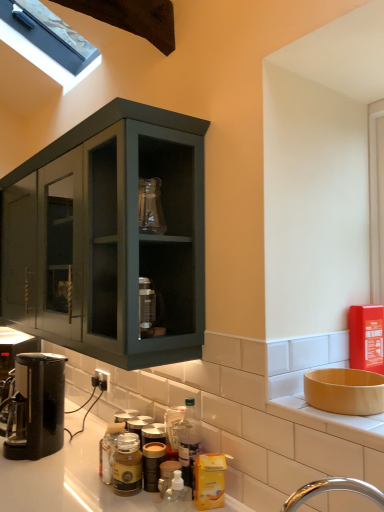
Describe the element at coordinates (189, 443) in the screenshot. I see `translucent plastic bottle at lower center, marked as the first bottle in a back-to-front arrangement` at that location.

Describe the element at coordinates (36, 407) in the screenshot. This screenshot has height=512, width=384. I see `black plastic coffee machine at lower left, the first coffee machine when ordered from front to back` at that location.

Describe the element at coordinates (209, 481) in the screenshot. This screenshot has width=384, height=512. I see `yellow plastic bottle at lower center, which is counted as the first bottle, starting from the right` at that location.

What do you see at coordinates (12, 355) in the screenshot?
I see `black plastic coffee machine at lower left, positioned as the first coffee machine in left-to-right order` at bounding box center [12, 355].

Locate an element on the screen. translucent plastic bottle at lower center, arranged as the first bottle when viewed from the front is located at coordinates (177, 495).

Based on the photo, in order to face translucent plastic bottle at lower center, the 4th bottle from the back, should I rotate leftwards or rightwards?

Rotate your view left by about 1.841°.

Consider the image. What is the approximate width of matte yellow bowl at right?

It is 8.83 inches.

This screenshot has height=512, width=384. Find the location of `translucent plastic bottle at lower center, which is the third bottle from left to right`. translucent plastic bottle at lower center, which is the third bottle from left to right is located at coordinates (189, 443).

At what (x,y) coordinates should I click in order to perform the action: click on the 1st bottle in front of the black plastic electric outlet at lower left, counting from the anchor's position. Please return your answer as a coordinate pair (x, y). The height and width of the screenshot is (512, 384). Looking at the image, I should click on (189, 443).

Would you say black plastic electric outlet at lower left is outside translucent plastic bottle at lower center, placed as the 4th bottle when sorted from front to back?

Yes, black plastic electric outlet at lower left is outside of translucent plastic bottle at lower center, placed as the 4th bottle when sorted from front to back.

Consider the image. Can you see black plastic electric outlet at lower left touching translucent plastic bottle at lower center, marked as the first bottle in a back-to-front arrangement?

No, black plastic electric outlet at lower left is not beside translucent plastic bottle at lower center, marked as the first bottle in a back-to-front arrangement.

Considering the positions of point (96, 375) and point (189, 453), is point (96, 375) closer or farther from the camera than point (189, 453)?

Point (96, 375) is farther from the camera than point (189, 453).

Is matte yellow bowl at right in front of or behind translucent plastic bottle at lower center, which is the second bottle from right to left, in the image?

Visually, matte yellow bowl at right is located in front of translucent plastic bottle at lower center, which is the second bottle from right to left.

Is matte yellow bowl at right smaller than translucent plastic bottle at lower center, marked as the first bottle in a back-to-front arrangement?

No.

Is matte yellow bowl at right taller than translucent plastic bottle at lower center, marked as the first bottle in a back-to-front arrangement?

In fact, matte yellow bowl at right may be shorter than translucent plastic bottle at lower center, marked as the first bottle in a back-to-front arrangement.

Would you consider matte yellow bowl at right to be distant from translucent plastic bottle at lower center, which is the third bottle from left to right?

No, there isn't a large distance between matte yellow bowl at right and translucent plastic bottle at lower center, which is the third bottle from left to right.

Is black plastic coffee machine at lower left, arranged as the 2th coffee machine when viewed from the back, located within matte yellow bowl at right?

No, black plastic coffee machine at lower left, arranged as the 2th coffee machine when viewed from the back, is not a part of matte yellow bowl at right.

Is matte yellow bowl at right thinner than black plastic coffee machine at lower left, the first coffee machine when ordered from front to back?

Indeed, matte yellow bowl at right has a lesser width compared to black plastic coffee machine at lower left, the first coffee machine when ordered from front to back.

Who is taller, matte yellow bowl at right or black plastic coffee machine at lower left, the first coffee machine when ordered from front to back?

With more height is black plastic coffee machine at lower left, the first coffee machine when ordered from front to back.

From a real-world perspective, which object rests below the other?

matte glass jar at center, marked as the first bottle in a left-to-right arrangement, from a real-world perspective.

From the image's perspective, is matte glass jar at center, positioned as the 4th bottle in right-to-left order, beneath black plastic electric outlet at lower left?

Correct, matte glass jar at center, positioned as the 4th bottle in right-to-left order, appears lower than black plastic electric outlet at lower left in the image.

Considering the sizes of objects matte glass jar at center, arranged as the 2th bottle when viewed from the back, and black plastic electric outlet at lower left in the image provided, who is thinner, matte glass jar at center, arranged as the 2th bottle when viewed from the back, or black plastic electric outlet at lower left?

black plastic electric outlet at lower left is thinner.

Considering the sizes of matte glass jar at center, positioned as the 4th bottle in right-to-left order, and black plastic electric outlet at lower left in the image, is matte glass jar at center, positioned as the 4th bottle in right-to-left order, taller or shorter than black plastic electric outlet at lower left?

Considering their sizes, matte glass jar at center, positioned as the 4th bottle in right-to-left order, has more height than black plastic electric outlet at lower left.

Is black plastic coffee machine at lower left, positioned as the first coffee machine in back-to-front order, turned away from black plastic electric outlet at lower left?

No.

How distant is black plastic coffee machine at lower left, positioned as the first coffee machine in left-to-right order, from black plastic electric outlet at lower left?

The distance of black plastic coffee machine at lower left, positioned as the first coffee machine in left-to-right order, from black plastic electric outlet at lower left is 17.47 inches.

How different are the orientations of black plastic coffee machine at lower left, the second coffee machine positioned from the front, and black plastic electric outlet at lower left in degrees?

black plastic coffee machine at lower left, the second coffee machine positioned from the front, and black plastic electric outlet at lower left are facing 49.5 degrees away from each other.

Consider the image. Does black plastic coffee machine at lower left, positioned as the first coffee machine in left-to-right order, have a smaller size compared to black plastic electric outlet at lower left?

Actually, black plastic coffee machine at lower left, positioned as the first coffee machine in left-to-right order, might be larger than black plastic electric outlet at lower left.

From a real-world perspective, is matte glass jar at center, positioned as the 4th bottle in right-to-left order, over black plastic coffee machine at lower left, positioned as the first coffee machine in back-to-front order?

Incorrect, from a real-world perspective, matte glass jar at center, positioned as the 4th bottle in right-to-left order, is lower than black plastic coffee machine at lower left, positioned as the first coffee machine in back-to-front order.

Is matte glass jar at center, which is the 3th bottle in front-to-back order, located outside black plastic coffee machine at lower left, positioned as the first coffee machine in back-to-front order?

matte glass jar at center, which is the 3th bottle in front-to-back order, is positioned outside black plastic coffee machine at lower left, positioned as the first coffee machine in back-to-front order.

Which object is closer to the camera taking this photo, matte glass jar at center, marked as the first bottle in a left-to-right arrangement, or black plastic coffee machine at lower left, the second coffee machine positioned from the front?

matte glass jar at center, marked as the first bottle in a left-to-right arrangement, is more forward.

Is matte glass jar at center, marked as the first bottle in a left-to-right arrangement, facing towards black plastic coffee machine at lower left, positioned as the first coffee machine in back-to-front order?

No, matte glass jar at center, marked as the first bottle in a left-to-right arrangement, is not oriented towards black plastic coffee machine at lower left, positioned as the first coffee machine in back-to-front order.

In the scene shown: Which object is further away from the camera taking this photo, matte glass jar at center, positioned as the 4th bottle in right-to-left order, or matte yellow bowl at right?

matte glass jar at center, positioned as the 4th bottle in right-to-left order, is behind.

Can you confirm if matte glass jar at center, marked as the first bottle in a left-to-right arrangement, is wider than matte yellow bowl at right?

In fact, matte glass jar at center, marked as the first bottle in a left-to-right arrangement, might be narrower than matte yellow bowl at right.

Considering the relative sizes of matte glass jar at center, which is the 3th bottle in front-to-back order, and matte yellow bowl at right in the image provided, is matte glass jar at center, which is the 3th bottle in front-to-back order, smaller than matte yellow bowl at right?

Correct, matte glass jar at center, which is the 3th bottle in front-to-back order, occupies less space than matte yellow bowl at right.

Is matte glass jar at center, which is the 3th bottle in front-to-back order, not within matte yellow bowl at right?

Absolutely, matte glass jar at center, which is the 3th bottle in front-to-back order, is external to matte yellow bowl at right.

At what (x,y) coordinates should I click in order to perform the action: click on bottle that is the 3rd object to the right of the black plastic electric outlet at lower left, starting at the anchor. Please return your answer as a coordinate pair (x, y). Image resolution: width=384 pixels, height=512 pixels. Looking at the image, I should click on (189, 443).

Image resolution: width=384 pixels, height=512 pixels. Find the location of `bottle that is the 4th object located behind the matte yellow bowl at right`. bottle that is the 4th object located behind the matte yellow bowl at right is located at coordinates [189, 443].

Estimate the real-world distances between objects in this image. Which object is further from translucent plastic bottle at lower center, placed as the 2th bottle when sorted from left to right, matte yellow bowl at right or yellow plastic bottle at lower center, the 2th bottle positioned from the front?

matte yellow bowl at right is positioned further to the anchor translucent plastic bottle at lower center, placed as the 2th bottle when sorted from left to right.

Considering their positions, is yellow plastic bottle at lower center, the 2th bottle positioned from the front, positioned further to translucent plastic bottle at lower center, which is the third bottle from left to right, than translucent plastic bottle at lower center, the 4th bottle from the back?

translucent plastic bottle at lower center, the 4th bottle from the back, is positioned further to the anchor translucent plastic bottle at lower center, which is the third bottle from left to right.

Which object lies further to the anchor point black plastic coffee machine at lower left, arranged as the second coffee machine when viewed from the left, black plastic electric outlet at lower left or translucent plastic bottle at lower center, arranged as the first bottle when viewed from the front?

Among the two, translucent plastic bottle at lower center, arranged as the first bottle when viewed from the front, is located further to black plastic coffee machine at lower left, arranged as the second coffee machine when viewed from the left.

Estimate the real-world distances between objects in this image. Which object is closer to black plastic electric outlet at lower left, matte yellow bowl at right or black plastic coffee machine at lower left, the first coffee machine when ordered from front to back?

The object closer to black plastic electric outlet at lower left is black plastic coffee machine at lower left, the first coffee machine when ordered from front to back.

Which object lies nearer to the anchor point yellow plastic bottle at lower center, the 2th bottle positioned from the front, translucent plastic bottle at lower center, which is the third bottle from left to right, or matte yellow bowl at right?

translucent plastic bottle at lower center, which is the third bottle from left to right, is closer to yellow plastic bottle at lower center, the 2th bottle positioned from the front.

Estimate the real-world distances between objects in this image. Which object is closer to matte yellow bowl at right, black plastic coffee machine at lower left, arranged as the second coffee machine when viewed from the left, or black plastic coffee machine at lower left, positioned as the first coffee machine in left-to-right order?

Based on the image, black plastic coffee machine at lower left, arranged as the second coffee machine when viewed from the left, appears to be nearer to matte yellow bowl at right.

Looking at the image, which one is located closer to yellow plastic bottle at lower center, positioned as the fourth bottle in left-to-right order, matte glass jar at center, marked as the first bottle in a left-to-right arrangement, or matte yellow bowl at right?

matte glass jar at center, marked as the first bottle in a left-to-right arrangement, lies closer to yellow plastic bottle at lower center, positioned as the fourth bottle in left-to-right order, than the other object.

Estimate the real-world distances between objects in this image. Which object is further from matte glass jar at center, which is the 3th bottle in front-to-back order, translucent plastic bottle at lower center, the 4th bottle from the back, or black plastic electric outlet at lower left?

Among the two, black plastic electric outlet at lower left is located further to matte glass jar at center, which is the 3th bottle in front-to-back order.

Identify the location of electric outlet positioned between black plastic coffee machine at lower left, arranged as the 2th coffee machine when viewed from the back, and black plastic coffee machine at lower left, acting as the 2th coffee machine starting from the right, from near to far. The image size is (384, 512). (102, 380).

The image size is (384, 512). Identify the location of electric outlet between black plastic coffee machine at lower left, the second coffee machine positioned from the front, and translucent plastic bottle at lower center, marked as the first bottle in a back-to-front arrangement. (102, 380).

You are a GUI agent. You are given a task and a screenshot of the screen. Output one action in this format:
    pyautogui.click(x=<x>, y=<y>)
    Task: Click on the coffee machine between translucent plastic bottle at lower center, the 4th bottle from the back, and black plastic electric outlet at lower left, along the z-axis
    The width and height of the screenshot is (384, 512).
    Given the screenshot: What is the action you would take?
    pyautogui.click(x=36, y=407)

Locate an element on the screen. The height and width of the screenshot is (512, 384). coffee machine between yellow plastic bottle at lower center, the 2th bottle positioned from the front, and black plastic electric outlet at lower left, along the z-axis is located at coordinates (36, 407).